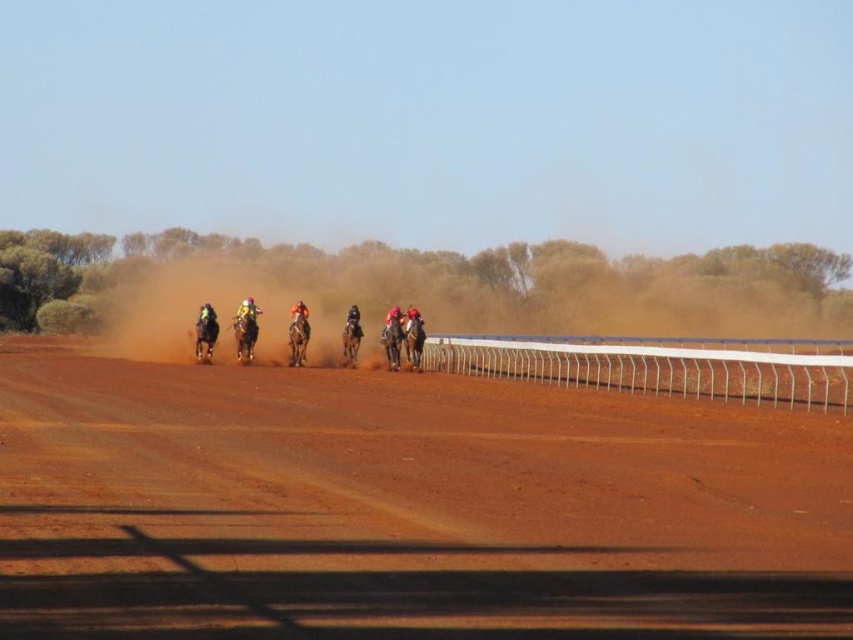
You are a spectator watching the horse race from the starting line. You notice two points marked on the track. Which point is closer to the finish line? The points are labeled as point (229, 499) and point (306, 316).

Point (229, 499) is in front of point (306, 316), so it is closer to the finish line.